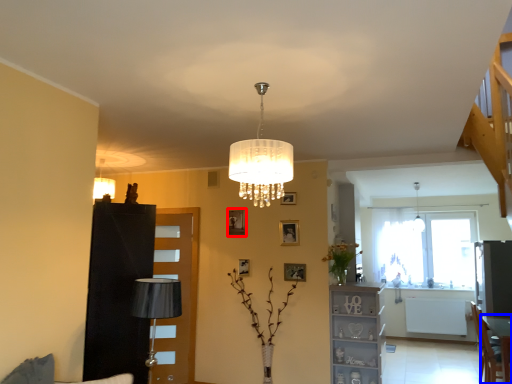
Question: Among these objects, which one is nearest to the camera, picture frame (highlighted by a red box) or table (highlighted by a blue box)?

Choices:
 (A) picture frame
 (B) table

Answer: (B)